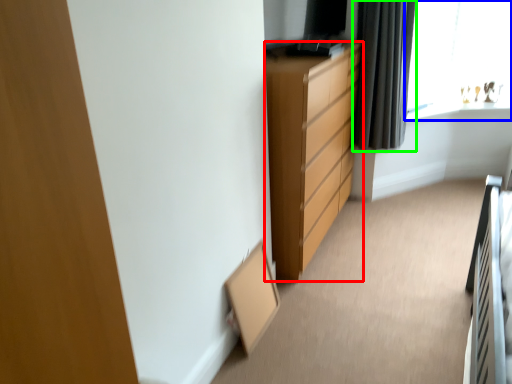
Question: Estimate the real-world distances between objects in this image. Which object is farther from chest of drawers (highlighted by a red box), window (highlighted by a blue box) or curtain (highlighted by a green box)?

Choices:
 (A) window
 (B) curtain

Answer: (A)